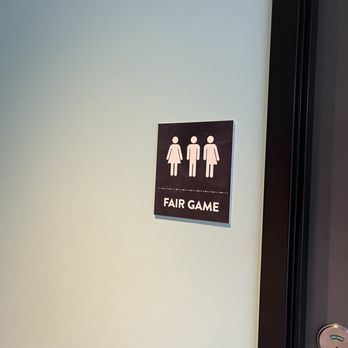
Image resolution: width=348 pixels, height=348 pixels. I want to click on door frame, so click(280, 221).